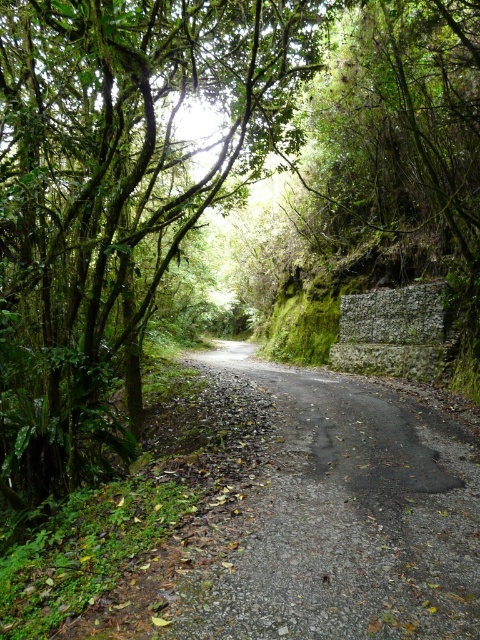
Question: Is green leafy tree at center smaller than dark gray asphalt road at center?

Choices:
 (A) yes
 (B) no

Answer: (B)

Question: Which point is closer to the camera taking this photo?

Choices:
 (A) (222, 163)
 (B) (228, 364)

Answer: (A)

Question: Does green leafy tree at center have a lesser width compared to dark gray asphalt road at center?

Choices:
 (A) yes
 (B) no

Answer: (B)

Question: Which of the following is the farthest from the observer?

Choices:
 (A) dark gray asphalt road at center
 (B) green leafy tree at center

Answer: (B)

Question: Does green leafy tree at center appear on the left side of dark gray asphalt road at center?

Choices:
 (A) yes
 (B) no

Answer: (A)